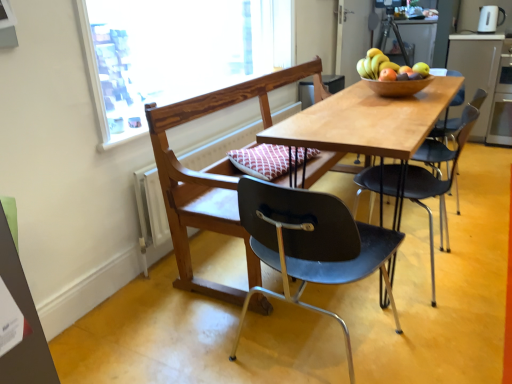
The width and height of the screenshot is (512, 384). In order to click on wooden table at center in this screenshot , I will do `click(366, 121)`.

Locate an element on the screen. The height and width of the screenshot is (384, 512). smooth yellow pear at upper right, which ranks as the 2th fruit in left-to-right order is located at coordinates (421, 69).

This screenshot has height=384, width=512. Describe the element at coordinates (386, 66) in the screenshot. I see `shiny brown bowl at upper right, which is the first fruit in left-to-right order` at that location.

The image size is (512, 384). What do you see at coordinates (19, 322) in the screenshot?
I see `green cardboard bulletin board at lower left` at bounding box center [19, 322].

Where is `green cardboard bulletin board at lower left`? green cardboard bulletin board at lower left is located at coordinates (19, 322).

The image size is (512, 384). What do you see at coordinates (211, 177) in the screenshot? I see `wooden chair at center, which appears as the 2th chair when viewed from the front` at bounding box center [211, 177].

Where is `wooden table at center`? The width and height of the screenshot is (512, 384). wooden table at center is located at coordinates (366, 121).

The height and width of the screenshot is (384, 512). Find the location of `bowl that appears below the smooth yellow pear at upper right, arranged as the 1th fruit when viewed from the right (from a real-world perspective)`. bowl that appears below the smooth yellow pear at upper right, arranged as the 1th fruit when viewed from the right (from a real-world perspective) is located at coordinates (398, 86).

Which object is thinner, smooth yellow pear at upper right, arranged as the 1th fruit when viewed from the right, or wooden bowl at upper center?

Thinner between the two is smooth yellow pear at upper right, arranged as the 1th fruit when viewed from the right.

Is smooth yellow pear at upper right, which ranks as the 2th fruit in left-to-right order, taller than wooden bowl at upper center?

No.

Can wooden bowl at upper center be found inside smooth yellow pear at upper right, which ranks as the 2th fruit in left-to-right order?

Definitely not — wooden bowl at upper center is not inside smooth yellow pear at upper right, which ranks as the 2th fruit in left-to-right order.

From their relative heights in the image, would you say matte black chair at center, which is the 3th chair from front to back, is taller or shorter than wooden chair at center, which appears as the 2th chair when viewed from the front?

Clearly, matte black chair at center, which is the 3th chair from front to back, is shorter compared to wooden chair at center, which appears as the 2th chair when viewed from the front.

Considering the positions of objects matte black chair at center, which is the 3th chair from front to back, and wooden chair at center, positioned as the second chair in back-to-front order, in the image provided, who is more to the right, matte black chair at center, which is the 3th chair from front to back, or wooden chair at center, positioned as the second chair in back-to-front order,?

Positioned to the right is matte black chair at center, which is the 3th chair from front to back.

Does matte black chair at center, which is the 3th chair from front to back, turn towards wooden chair at center, positioned as the second chair in back-to-front order?

Yes, matte black chair at center, which is the 3th chair from front to back, is oriented towards wooden chair at center, positioned as the second chair in back-to-front order.

Is matte black chair at center, which is the 3th chair from front to back, not inside wooden chair at center, which appears as the 2th chair when viewed from the front?

Yes, matte black chair at center, which is the 3th chair from front to back, is not within wooden chair at center, which appears as the 2th chair when viewed from the front.

Is matte black chair at center, which is the 3th chair from front to back, completely or partially outside of smooth yellow pear at upper right, arranged as the 1th fruit when viewed from the right?

matte black chair at center, which is the 3th chair from front to back, lies outside smooth yellow pear at upper right, arranged as the 1th fruit when viewed from the right,'s area.

Is matte black chair at center, which is the 3th chair from front to back, not close to smooth yellow pear at upper right, arranged as the 1th fruit when viewed from the right?

Actually, matte black chair at center, which is the 3th chair from front to back, and smooth yellow pear at upper right, arranged as the 1th fruit when viewed from the right, are a little close together.

Does matte black chair at center, which appears as the first chair when viewed from the front, have a smaller size compared to smooth yellow pear at upper right, arranged as the 1th fruit when viewed from the right?

No.

Which object is positioned more to the left, matte black chair at center, positioned as the third chair in back-to-front order, or smooth yellow pear at upper right, arranged as the 1th fruit when viewed from the right?

Positioned to the left is matte black chair at center, positioned as the third chair in back-to-front order.

Is wooden chair at center, which appears as the 2th chair when viewed from the front, not near green cardboard bulletin board at lower left?

Yes, wooden chair at center, which appears as the 2th chair when viewed from the front, and green cardboard bulletin board at lower left are quite far apart.

Who is more distant, wooden chair at center, which appears as the 2th chair when viewed from the front, or green cardboard bulletin board at lower left?

wooden chair at center, which appears as the 2th chair when viewed from the front, is further from the camera.

From the image's perspective, who appears lower, wooden chair at center, positioned as the second chair in back-to-front order, or green cardboard bulletin board at lower left?

green cardboard bulletin board at lower left appears lower in the image.

In order to click on the 2nd chair to the right of the green cardboard bulletin board at lower left, counting from the anchor's position in this screenshot , I will do `click(211, 177)`.

Which is behind, point (325, 151) or point (309, 120)?

The point (309, 120) is farther.

Is wooden chair at center, which appears as the 2th chair when viewed from the front, shorter than wooden table at center?

No.

From a real-world perspective, who is located higher, wooden chair at center, which appears as the 2th chair when viewed from the front, or wooden table at center?

From a 3D spatial view, wooden chair at center, which appears as the 2th chair when viewed from the front, is above.

The image size is (512, 384). I want to click on chair above the wooden table at center (from the image's perspective), so click(x=211, y=177).

From a real-world perspective, is wooden bowl at upper center on wooden table at center?

Indeed, from a real-world perspective, wooden bowl at upper center stands above wooden table at center.

Between wooden bowl at upper center and wooden table at center, which one has less height?

With less height is wooden bowl at upper center.

Is wooden bowl at upper center not close to wooden table at center?

They are positioned close to each other.

Considering the positions of point (406, 93) and point (428, 114), is point (406, 93) closer or farther from the camera than point (428, 114)?

Clearly, point (406, 93) is more distant from the camera than point (428, 114).

In order to click on bowl that appears below the smooth yellow pear at upper right, which ranks as the 2th fruit in left-to-right order (from a real-world perspective) in this screenshot , I will do (x=398, y=86).

You are a GUI agent. You are given a task and a screenshot of the screen. Output one action in this format:
    pyautogui.click(x=<x>, y=<y>)
    Task: Click on the chair lying behind the wooden chair at center, which appears as the 2th chair when viewed from the front
    The width and height of the screenshot is (512, 384).
    Given the screenshot: What is the action you would take?
    pyautogui.click(x=438, y=179)

When comparing their distances from shiny brown bowl at upper right, which is the first fruit in left-to-right order, does matte black chair at center, arranged as the 1th chair when viewed from the back, or matte black chair at center, positioned as the third chair in back-to-front order, seem closer?

Based on the image, matte black chair at center, arranged as the 1th chair when viewed from the back, appears to be nearer to shiny brown bowl at upper right, which is the first fruit in left-to-right order.

Based on their spatial positions, is matte black chair at center, which is the 3th chair from front to back, or matte black chair at center, which appears as the first chair when viewed from the front, further from smooth yellow pear at upper right, arranged as the 1th fruit when viewed from the right?

Among the two, matte black chair at center, which appears as the first chair when viewed from the front, is located further to smooth yellow pear at upper right, arranged as the 1th fruit when viewed from the right.

Looking at the image, which one is located further to smooth yellow pear at upper right, arranged as the 1th fruit when viewed from the right, shiny brown bowl at upper right, acting as the 2th fruit starting from the right, or white glossy electric kettle at upper right?

white glossy electric kettle at upper right is further to smooth yellow pear at upper right, arranged as the 1th fruit when viewed from the right.

Which object lies nearer to the anchor point wooden table at center, white glossy electric kettle at upper right or wooden bowl at upper center?

Among the two, wooden bowl at upper center is located nearer to wooden table at center.

Estimate the real-world distances between objects in this image. Which object is further from shiny brown bowl at upper right, which is the first fruit in left-to-right order, wooden bowl at upper center or wooden table at center?

Based on the image, wooden table at center appears to be further to shiny brown bowl at upper right, which is the first fruit in left-to-right order.

Which object lies further to the anchor point matte black chair at center, which appears as the first chair when viewed from the front, smooth yellow pear at upper right, which ranks as the 2th fruit in left-to-right order, or wooden table at center?

smooth yellow pear at upper right, which ranks as the 2th fruit in left-to-right order, is further to matte black chair at center, which appears as the first chair when viewed from the front.

When comparing their distances from shiny brown bowl at upper right, which is the first fruit in left-to-right order, does wooden chair at center, which appears as the 2th chair when viewed from the front, or green cardboard bulletin board at lower left seem further?

The object further to shiny brown bowl at upper right, which is the first fruit in left-to-right order, is green cardboard bulletin board at lower left.

In the scene shown: Which object lies nearer to the anchor point white glossy electric kettle at upper right, matte black chair at center, arranged as the 1th chair when viewed from the back, or wooden chair at center, which appears as the 2th chair when viewed from the front?

The object closer to white glossy electric kettle at upper right is matte black chair at center, arranged as the 1th chair when viewed from the back.

Where is `table located between matte black chair at center, positioned as the third chair in back-to-front order, and matte black chair at center, arranged as the 1th chair when viewed from the back, in the left-right direction`? table located between matte black chair at center, positioned as the third chair in back-to-front order, and matte black chair at center, arranged as the 1th chair when viewed from the back, in the left-right direction is located at coordinates (366, 121).

Locate an element on the screen. The height and width of the screenshot is (384, 512). bowl between wooden chair at center, which appears as the 2th chair when viewed from the front, and smooth yellow pear at upper right, arranged as the 1th fruit when viewed from the right, along the z-axis is located at coordinates (398, 86).

You are a GUI agent. You are given a task and a screenshot of the screen. Output one action in this format:
    pyautogui.click(x=<x>, y=<y>)
    Task: Click on the fruit between wooden chair at center, which appears as the 2th chair when viewed from the front, and smooth yellow pear at upper right, arranged as the 1th fruit when viewed from the right, from front to back
    The image size is (512, 384).
    Given the screenshot: What is the action you would take?
    pyautogui.click(x=386, y=66)

Where is `chair positioned between green cardboard bulletin board at lower left and wooden chair at center, which appears as the 2th chair when viewed from the front, from near to far`? This screenshot has width=512, height=384. chair positioned between green cardboard bulletin board at lower left and wooden chair at center, which appears as the 2th chair when viewed from the front, from near to far is located at coordinates (311, 244).